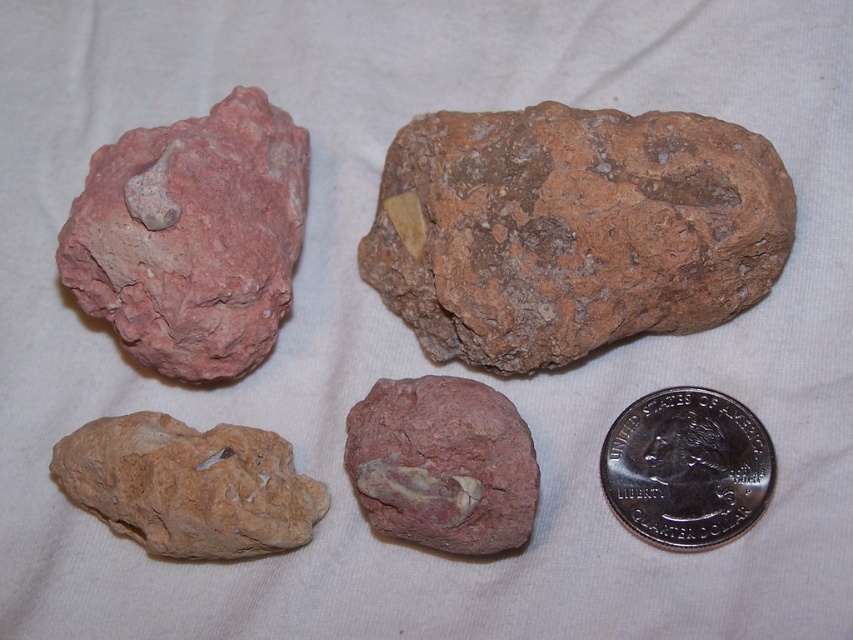
Can you confirm if brown matte rock at upper center is wider than silver/smooth quarter at upper right?

Indeed, brown matte rock at upper center has a greater width compared to silver/smooth quarter at upper right.

Between brown matte rock at upper center and silver/smooth quarter at upper right, which one appears on the right side from the viewer's perspective?

From the viewer's perspective, silver/smooth quarter at upper right appears more on the right side.

Measure the distance between point (576, 320) and camera.

A distance of 4.46 feet exists between point (576, 320) and camera.

Locate an element on the screen. This screenshot has width=853, height=640. brown matte rock at upper center is located at coordinates (572, 230).

Can you confirm if brown matte rock at upper center is wider than matte stone rock at center?

Indeed, brown matte rock at upper center has a greater width compared to matte stone rock at center.

Based on the photo, does brown matte rock at upper center appear under matte stone rock at center?

No.

Image resolution: width=853 pixels, height=640 pixels. Describe the element at coordinates (572, 230) in the screenshot. I see `brown matte rock at upper center` at that location.

Locate an element on the screen. The height and width of the screenshot is (640, 853). brown matte rock at upper center is located at coordinates (572, 230).

Does brown matte rock at lower left appear on the left side of matte stone rock at center?

Correct, you'll find brown matte rock at lower left to the left of matte stone rock at center.

Does point (178, 435) come in front of point (395, 390)?

Yes.

Locate an element on the screen. brown matte rock at lower left is located at coordinates (189, 486).